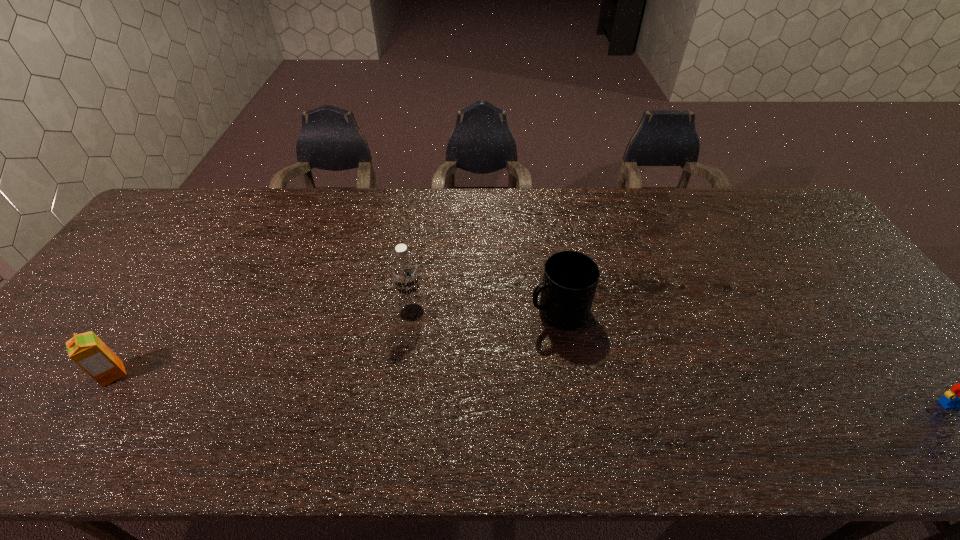
I want to click on the third farthest object, so click(87, 350).

The height and width of the screenshot is (540, 960). Find the location of `orange juice`. orange juice is located at coordinates (87, 350).

This screenshot has height=540, width=960. What are the coordinates of `mug` in the screenshot? It's located at (570, 279).

Locate an element on the screen. This screenshot has height=540, width=960. the third object from right to left is located at coordinates (405, 274).

Locate an element on the screen. Image resolution: width=960 pixels, height=540 pixels. vodka is located at coordinates (405, 274).

At what (x,y) coordinates should I click in order to perform the action: click on vacant area situated 0.350m on the back of the third farthest object. Please return your answer as a coordinate pair (x, y). Looking at the image, I should click on (187, 262).

This screenshot has height=540, width=960. I want to click on vacant region located on the side of the second object from right to left with the handle, so click(483, 345).

You are a GUI agent. You are given a task and a screenshot of the screen. Output one action in this format:
    pyautogui.click(x=<x>, y=<y>)
    Task: Click on the vacant space situated 0.260m on the side of the second object from right to left with the handle
    This screenshot has height=540, width=960.
    Given the screenshot: What is the action you would take?
    pyautogui.click(x=444, y=363)

You are a GUI agent. You are given a task and a screenshot of the screen. Output one action in this format:
    pyautogui.click(x=<x>, y=<y>)
    Task: Click on the blank area located 0.280m on the side of the second object from right to left with the handle
    The height and width of the screenshot is (540, 960).
    Given the screenshot: What is the action you would take?
    pyautogui.click(x=436, y=367)

Find the location of `vacant space situated 0.140m on the front label of the vodka`. vacant space situated 0.140m on the front label of the vodka is located at coordinates pos(406,370).